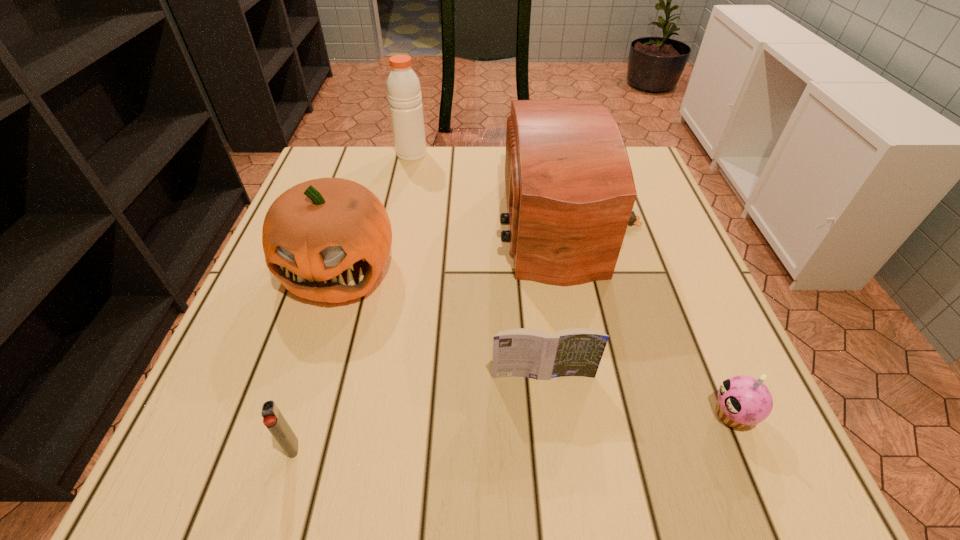
Where is `the farthest object`? The width and height of the screenshot is (960, 540). the farthest object is located at coordinates (404, 94).

Identify the location of radio receiver. (570, 191).

Find the location of `pumpkin`. pumpkin is located at coordinates (327, 240).

What are the coordinates of `book` in the screenshot? It's located at (520, 352).

Identify the location of cupcake. (743, 401).

This screenshot has height=540, width=960. Find the location of `the nearest object`. the nearest object is located at coordinates pos(273,419).

What are the coordinates of `vacant position located 0.160m on the left of the shaker` in the screenshot? It's located at (339, 154).

At what (x,y) coordinates should I click in order to perform the action: click on free space located on the front-facing side of the radio receiver. Please return your answer as a coordinate pair (x, y). Looking at the image, I should click on (455, 223).

Locate an element on the screen. free space located 0.380m on the front-facing side of the radio receiver is located at coordinates (333, 223).

The width and height of the screenshot is (960, 540). What are the coordinates of `vacant space situated on the front-facing side of the radio receiver` in the screenshot? It's located at (368, 223).